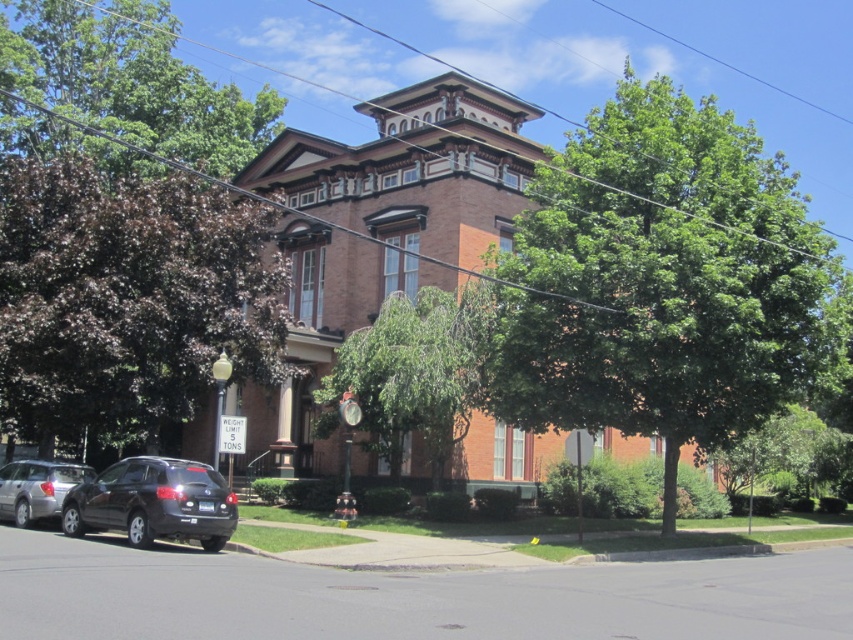
Does point (668, 349) come behind point (457, 304)?

No.

Between point (704, 132) and point (347, 371), which one is positioned behind?

The point (347, 371) is behind.

What do you see at coordinates (666, 282) in the screenshot?
I see `green leafy tree at upper center` at bounding box center [666, 282].

The height and width of the screenshot is (640, 853). Identify the location of green leafy tree at upper center. (666, 282).

Which of these two, purple-leaved tree at left or shiny black suv at lower left, stands shorter?

With less height is shiny black suv at lower left.

The height and width of the screenshot is (640, 853). I want to click on purple-leaved tree at left, so [126, 298].

Can you confirm if purple-leaved tree at left is positioned below green leafy tree at upper left?

Yes, purple-leaved tree at left is below green leafy tree at upper left.

Who is positioned more to the left, purple-leaved tree at left or green leafy tree at upper left?

green leafy tree at upper left is more to the left.

Find the location of a particular element. Image resolution: width=853 pixels, height=640 pixels. purple-leaved tree at left is located at coordinates (126, 298).